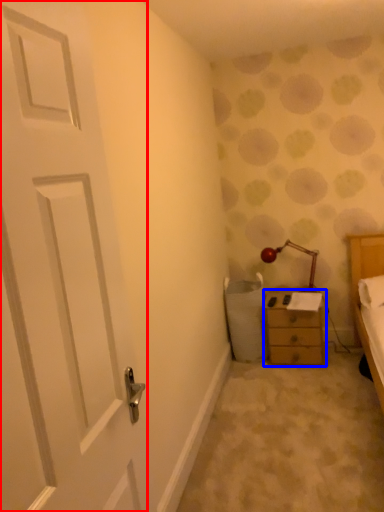
Question: Which point is closer to the camera, door (highlighted by a red box) or chest of drawers (highlighted by a blue box)?

Choices:
 (A) door
 (B) chest of drawers

Answer: (A)